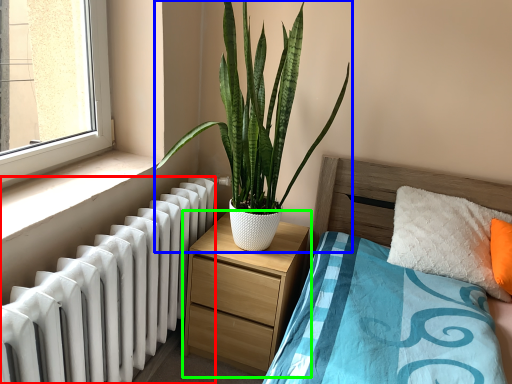
Question: Considering the real-world distances, which object is closest to radiator (highlighted by a red box)? houseplant (highlighted by a blue box) or nightstand (highlighted by a green box).

Choices:
 (A) houseplant
 (B) nightstand

Answer: (B)